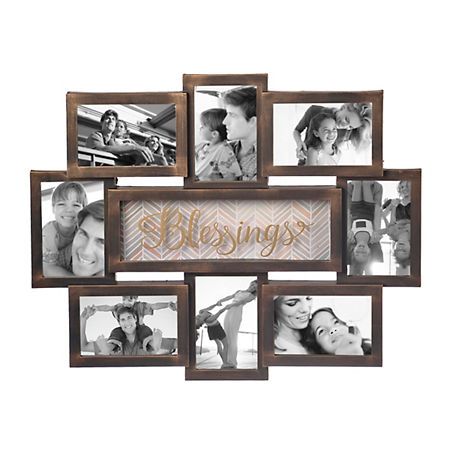
Locate an element on the screen. Image resolution: width=450 pixels, height=450 pixels. vertical frames is located at coordinates (221, 317), (375, 237), (222, 135), (80, 213).